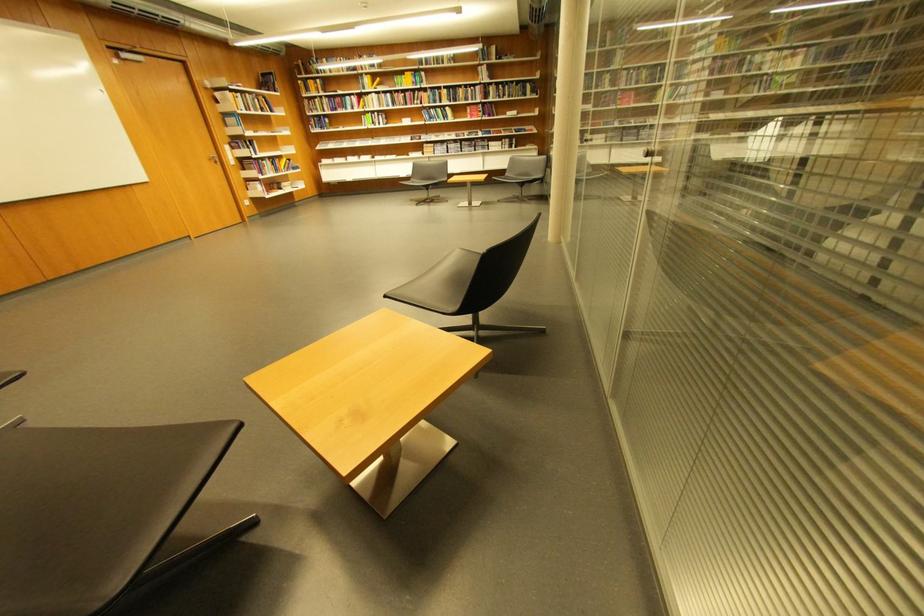
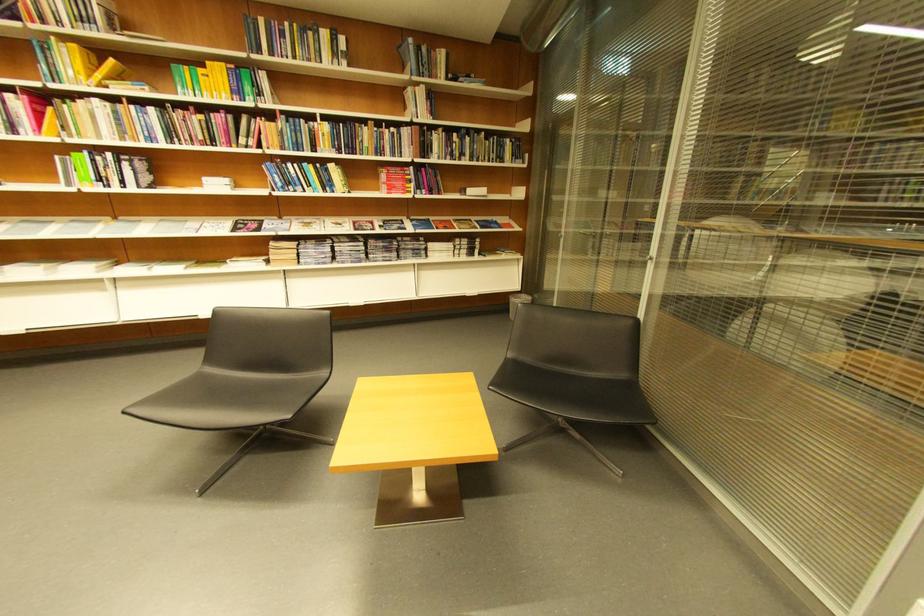
Where in the second image is the point corresponding to the point at 383,95 from the first image?

(106, 102)